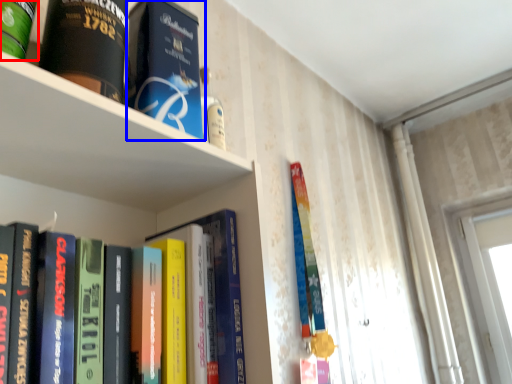
Question: Which point is closer to the camera, book (highlighted by a red box) or book (highlighted by a blue box)?

Choices:
 (A) book
 (B) book

Answer: (A)